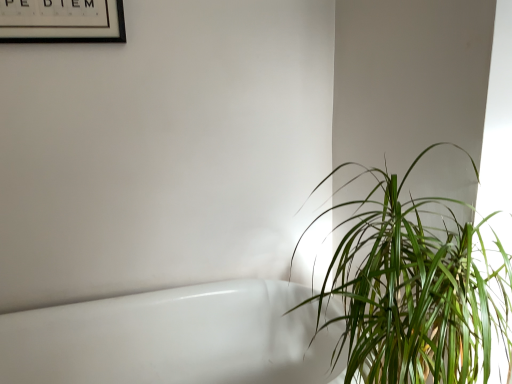
Question: From a real-world perspective, does green leafy plant at right sit lower than white glossy bathtub at lower left?

Choices:
 (A) no
 (B) yes

Answer: (A)

Question: Is white glossy bathtub at lower left at the back of green leafy plant at right?

Choices:
 (A) yes
 (B) no

Answer: (B)

Question: Is green leafy plant at right surrounding white glossy bathtub at lower left?

Choices:
 (A) yes
 (B) no

Answer: (B)

Question: Can you confirm if green leafy plant at right is positioned to the right of white glossy bathtub at lower left?

Choices:
 (A) no
 (B) yes

Answer: (B)

Question: Does green leafy plant at right turn towards white glossy bathtub at lower left?

Choices:
 (A) no
 (B) yes

Answer: (A)

Question: Considering the relative sizes of green leafy plant at right and white glossy bathtub at lower left in the image provided, is green leafy plant at right shorter than white glossy bathtub at lower left?

Choices:
 (A) yes
 (B) no

Answer: (B)

Question: Does white glossy bathtub at lower left have a larger size compared to green leafy plant at right?

Choices:
 (A) yes
 (B) no

Answer: (A)

Question: Is green leafy plant at right surrounded by white glossy bathtub at lower left?

Choices:
 (A) no
 (B) yes

Answer: (A)

Question: Considering the relative sizes of white glossy bathtub at lower left and green leafy plant at right in the image provided, is white glossy bathtub at lower left wider than green leafy plant at right?

Choices:
 (A) yes
 (B) no

Answer: (A)

Question: Is white glossy bathtub at lower left thinner than green leafy plant at right?

Choices:
 (A) no
 (B) yes

Answer: (A)

Question: Can you confirm if white glossy bathtub at lower left is positioned to the right of green leafy plant at right?

Choices:
 (A) yes
 (B) no

Answer: (B)

Question: Is white glossy bathtub at lower left in front of green leafy plant at right?

Choices:
 (A) no
 (B) yes

Answer: (A)

Question: Considering the relative positions of green leafy plant at right and black matte picture frame at upper left in the image provided, is green leafy plant at right to the left of black matte picture frame at upper left from the viewer's perspective?

Choices:
 (A) yes
 (B) no

Answer: (B)